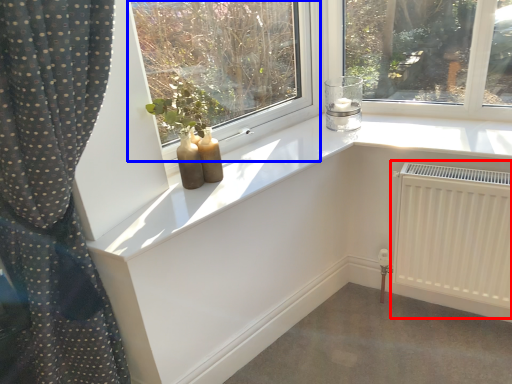
Question: Which object appears farthest to the camera in this image, radiator (highlighted by a red box) or window (highlighted by a blue box)?

Choices:
 (A) radiator
 (B) window

Answer: (A)